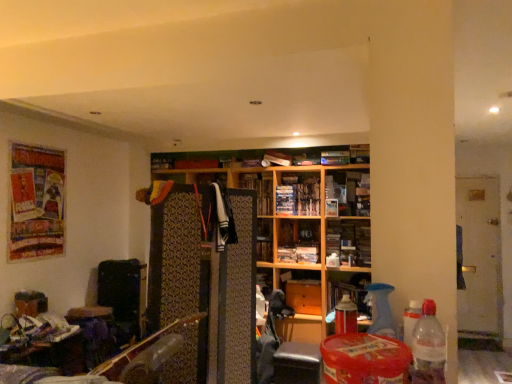
Question: Considering the relative positions of matte wood cabinet at center, the 1th cabinet when ordered from right to left, and matte white book at upper center, the first book in the top-to-bottom sequence, in the image provided, is matte wood cabinet at center, the 1th cabinet when ordered from right to left, in front of matte white book at upper center, the first book in the top-to-bottom sequence,?

Choices:
 (A) yes
 (B) no

Answer: (A)

Question: Is matte white book at upper center, the first book in the top-to-bottom sequence, surrounded by matte wood cabinet at center, the 1th cabinet when ordered from right to left?

Choices:
 (A) no
 (B) yes

Answer: (A)

Question: Does matte wood cabinet at center, the 1th cabinet when ordered from right to left, come behind matte white book at upper center, the 3th book when ordered from bottom to top?

Choices:
 (A) yes
 (B) no

Answer: (B)

Question: From the image's perspective, is matte wood cabinet at center, the 1th cabinet when ordered from right to left, above matte white book at upper center, the 3th book when ordered from bottom to top?

Choices:
 (A) yes
 (B) no

Answer: (B)

Question: From a real-world perspective, is matte wood cabinet at center, the 1th cabinet when ordered from right to left, on top of matte white book at upper center, the first book in the top-to-bottom sequence?

Choices:
 (A) yes
 (B) no

Answer: (B)

Question: Can you confirm if matte wood cabinet at center, the 1th cabinet when ordered from right to left, is smaller than matte white book at upper center, the first book in the top-to-bottom sequence?

Choices:
 (A) yes
 (B) no

Answer: (B)

Question: From the image's perspective, is matte wood cabinet at center, arranged as the second cabinet when viewed from the left, located beneath clear plastic bottle at lower right?

Choices:
 (A) no
 (B) yes

Answer: (B)

Question: Considering the relative positions of matte wood cabinet at center, the 1th cabinet when ordered from right to left, and clear plastic bottle at lower right in the image provided, is matte wood cabinet at center, the 1th cabinet when ordered from right to left, to the right of clear plastic bottle at lower right from the viewer's perspective?

Choices:
 (A) no
 (B) yes

Answer: (B)

Question: Is matte wood cabinet at center, the 1th cabinet when ordered from right to left, at the left side of clear plastic bottle at lower right?

Choices:
 (A) yes
 (B) no

Answer: (B)

Question: Does matte wood cabinet at center, arranged as the second cabinet when viewed from the left, have a greater width compared to clear plastic bottle at lower right?

Choices:
 (A) no
 (B) yes

Answer: (B)

Question: Is matte wood cabinet at center, the 1th cabinet when ordered from right to left, bigger than clear plastic bottle at lower right?

Choices:
 (A) no
 (B) yes

Answer: (B)

Question: Could you tell me if matte wood cabinet at center, the 1th cabinet when ordered from right to left, is turned towards clear plastic bottle at lower right?

Choices:
 (A) yes
 (B) no

Answer: (A)

Question: Is white glossy door at right bigger than matte wood cabinet at center, arranged as the second cabinet when viewed from the left?

Choices:
 (A) no
 (B) yes

Answer: (B)